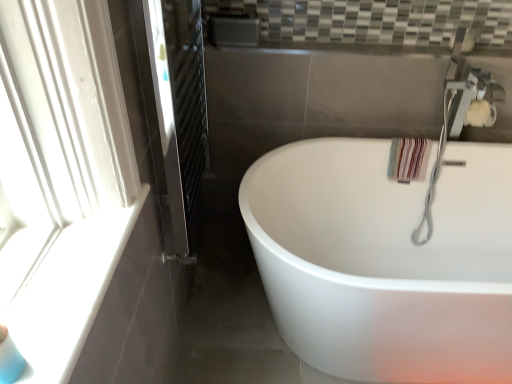
Question: Looking at the image, does white glossy bathtub at center seem bigger or smaller compared to silver metallic faucet at upper right?

Choices:
 (A) small
 (B) big

Answer: (B)

Question: Does point (279, 170) appear closer or farther from the camera than point (458, 165)?

Choices:
 (A) closer
 (B) farther

Answer: (A)

Question: Estimate the real-world distances between objects in this image. Which object is farther from the white glossy bathtub at center?

Choices:
 (A) clear glass screen door at left
 (B) silver metallic faucet at upper right

Answer: (A)

Question: Estimate the real-world distances between objects in this image. Which object is closer to the white glossy bathtub at center?

Choices:
 (A) clear glass screen door at left
 (B) silver metallic faucet at upper right

Answer: (B)